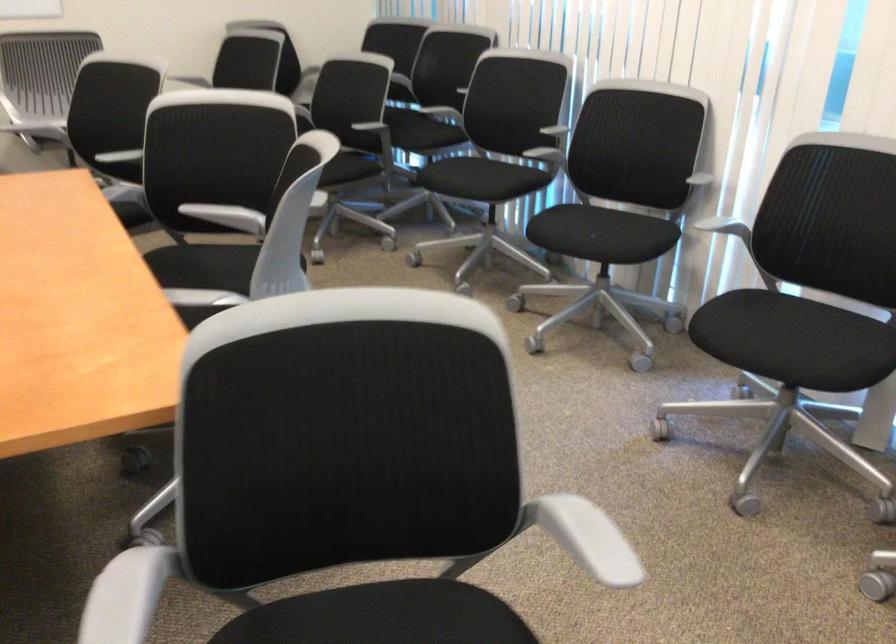
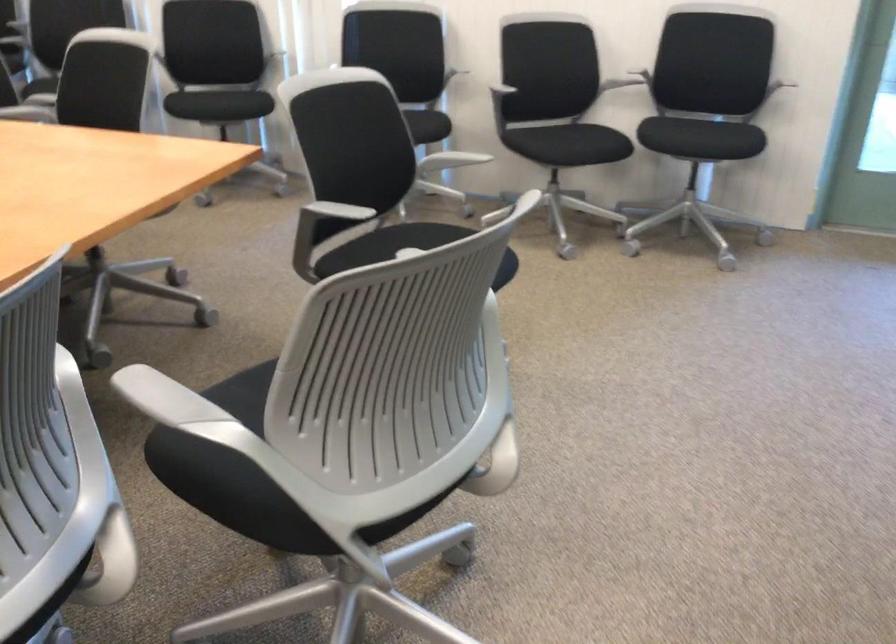
Question: I am providing you with two images of the same scene from different viewpoints. Please identify which objects are invisible in image2.

Choices:
 (A) gray chair armrest
 (B) black chair sitting surface
 (C) gray adjustment knob
 (D) silver metal handle

Answer: (B)